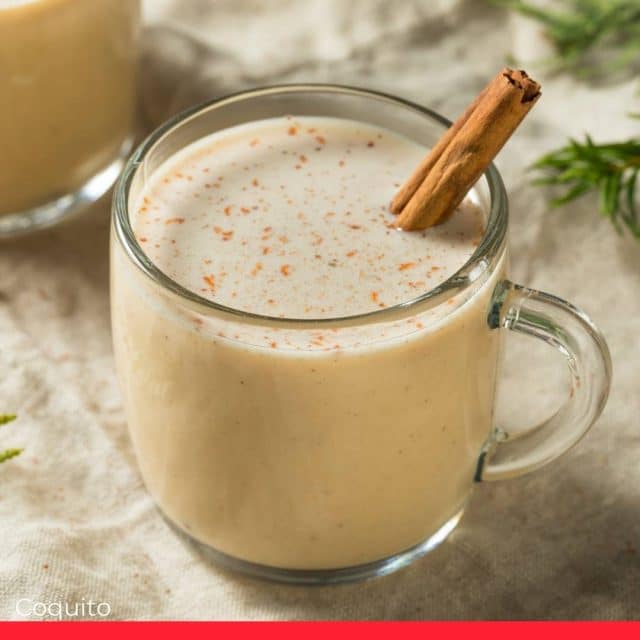
Image resolution: width=640 pixels, height=640 pixels. Identify the location of mug. (211, 432).